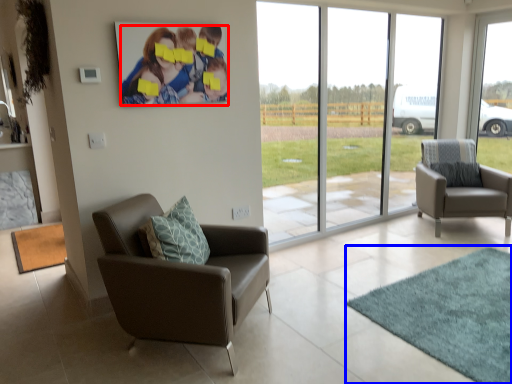
Question: Which of the following is the closest to the observer, couple (highlighted by a red box) or mat (highlighted by a blue box)?

Choices:
 (A) couple
 (B) mat

Answer: (B)